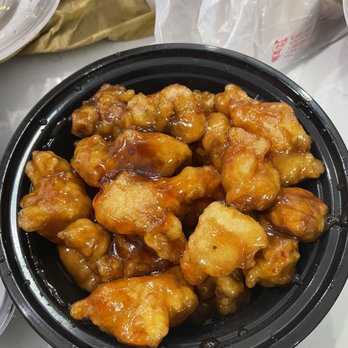
Find the location of a particular element. The image size is (348, 348). size of bowl is located at coordinates pyautogui.click(x=185, y=42), pyautogui.click(x=81, y=67), pyautogui.click(x=18, y=128), pyautogui.click(x=1, y=157), pyautogui.click(x=3, y=279), pyautogui.click(x=50, y=344), pyautogui.click(x=294, y=347), pyautogui.click(x=329, y=311), pyautogui.click(x=340, y=136), pyautogui.click(x=287, y=77).